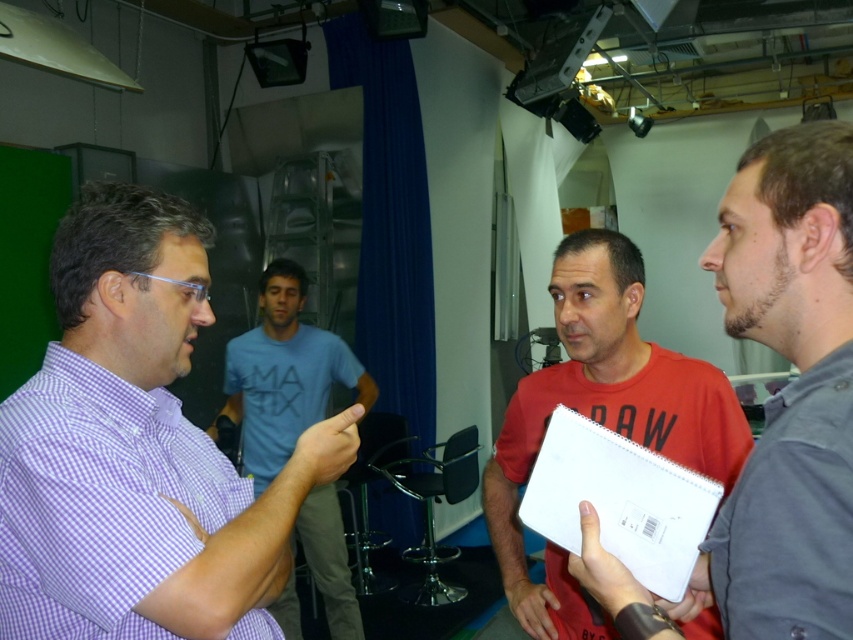
You are standing in the studio and see the point at coordinates (146, 330). If you want to place a small 0.5 meter wide object there, will it fit without overlapping anything?

The point at coordinates (146, 330) is 1.13 meters away from the viewer. Since the object is only 0.5 meters wide, it should fit without overlapping anything as there is sufficient space at that distance.

You are an artist who needs to sketch a detailed portrait. You have a matte gray notebook at center and a red matte shirt at center in front of you. Which object has a smaller width that might be more suitable for holding in one hand while drawing?

The matte gray notebook at center has a lesser width compared to the red matte shirt at center, making it more suitable for holding in one hand while drawing.